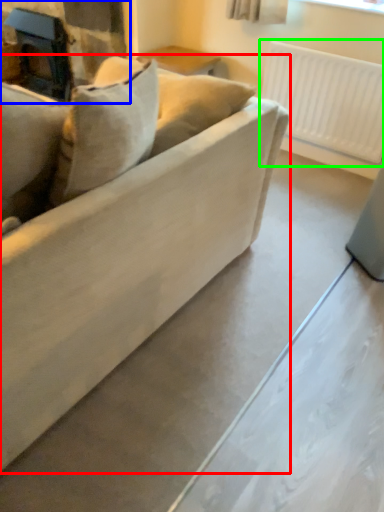
Question: Based on their relative distances, which object is farther from studio couch (highlighted by a red box)? Choose from fireplace (highlighted by a blue box) and radiator (highlighted by a green box).

Choices:
 (A) fireplace
 (B) radiator

Answer: (A)